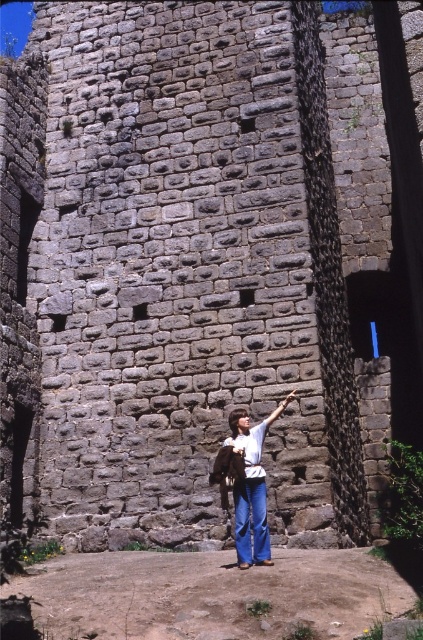
Question: Which of the following is the farthest from the observer?

Choices:
 (A) matte brown hand at center
 (B) matte brown leather arm at center
 (C) smooth skin hand at upper center
 (D) denim pants at center

Answer: (C)

Question: In this image, where is denim pants at center located relative to matte brown leather arm at center?

Choices:
 (A) right
 (B) left

Answer: (B)

Question: Which of the following is the closest to the observer?

Choices:
 (A) (286, 400)
 (B) (266, 417)
 (C) (230, 416)

Answer: (C)

Question: Does denim pants at center appear on the left side of matte brown hand at center?

Choices:
 (A) no
 (B) yes

Answer: (B)

Question: Which object appears farthest from the camera in this image?

Choices:
 (A) matte brown hand at center
 (B) denim pants at center
 (C) matte brown leather arm at center
 (D) smooth skin hand at upper center

Answer: (D)

Question: Is denim pants at center wider than smooth skin hand at upper center?

Choices:
 (A) yes
 (B) no

Answer: (A)